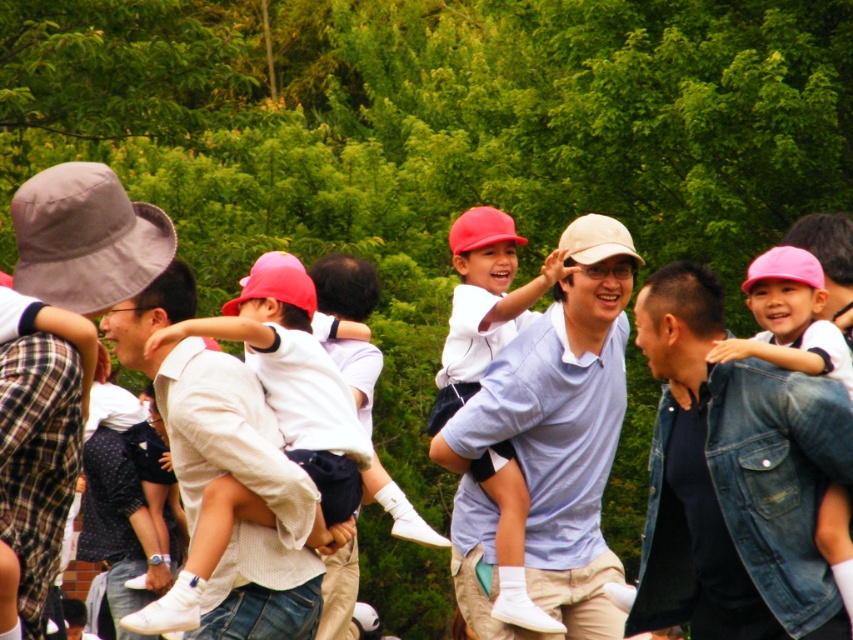
Question: Which point is farther to the camera?

Choices:
 (A) (80, 166)
 (B) (723, 358)

Answer: (B)

Question: Can you confirm if white textured shirt at center is positioned to the right of pink denim jacket at center?

Choices:
 (A) yes
 (B) no

Answer: (B)

Question: Does matte white shirt at center have a larger size compared to pink denim jacket at center?

Choices:
 (A) no
 (B) yes

Answer: (B)

Question: Is white textured shirt at center closer to the viewer compared to matte white shirt at center?

Choices:
 (A) yes
 (B) no

Answer: (A)

Question: Which is farther from the matte white shirt at center?

Choices:
 (A) pink denim jacket at center
 (B) gray fabric baseball hat at left

Answer: (B)

Question: Which point is closer to the camera taking this photo?

Choices:
 (A) pyautogui.click(x=102, y=253)
 (B) pyautogui.click(x=837, y=355)
 (C) pyautogui.click(x=469, y=288)

Answer: (A)